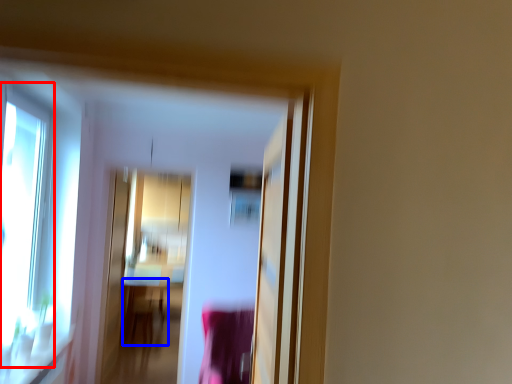
Question: Which object appears closest to the camera in this image, window (highlighted by a red box) or table (highlighted by a blue box)?

Choices:
 (A) window
 (B) table

Answer: (A)